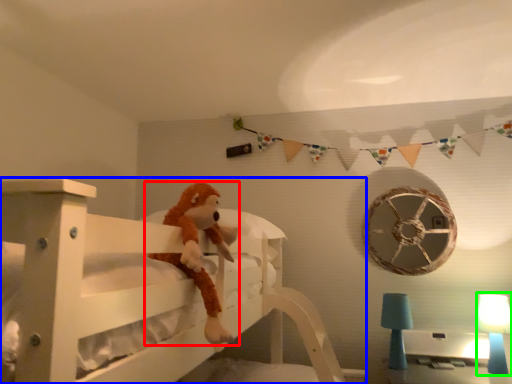
Question: Based on their relative distances, which object is nearer to toy (highlighted by a red box)? Choose from furniture (highlighted by a blue box) and table lamp (highlighted by a green box).

Choices:
 (A) furniture
 (B) table lamp

Answer: (A)